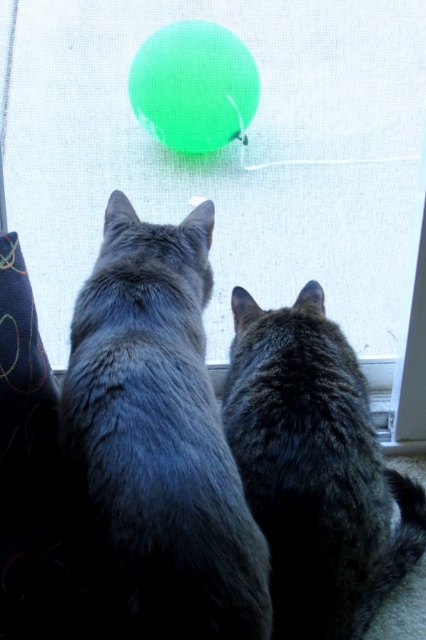
Question: Which of the following is the farthest from the observer?

Choices:
 (A) (371, 108)
 (B) (273, 340)
 (C) (216, 93)

Answer: (A)

Question: Can you confirm if transparent plastic screen door at upper center is positioned below green rubber ball at upper center?

Choices:
 (A) no
 (B) yes

Answer: (B)

Question: In this image, where is transparent plastic screen door at upper center located relative to green rubber ball at upper center?

Choices:
 (A) right
 (B) left

Answer: (A)

Question: Can you confirm if transparent plastic screen door at upper center is bigger than green rubber ball at upper center?

Choices:
 (A) yes
 (B) no

Answer: (A)

Question: Which object is closer to the camera taking this photo?

Choices:
 (A) transparent plastic screen door at upper center
 (B) green rubber ball at upper center
 (C) dark gray fur cat at center

Answer: (C)

Question: Estimate the real-world distances between objects in this image. Which object is closer to the dark gray fur cat at center?

Choices:
 (A) gray fluffy cat at center
 (B) transparent plastic screen door at upper center
 (C) green rubber ball at upper center

Answer: (A)